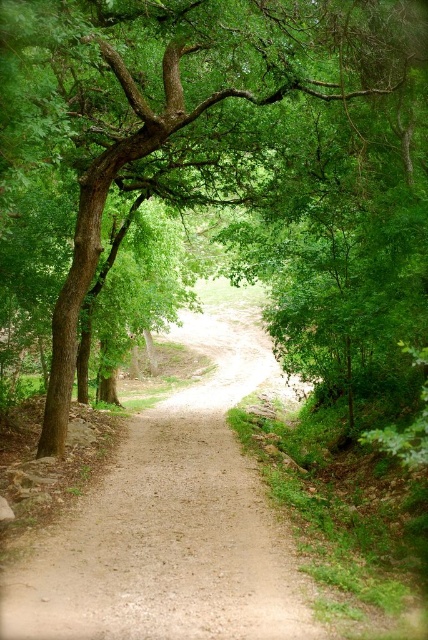
Question: Which point is farther from the camera taking this photo?

Choices:
 (A) (208, 442)
 (B) (345, 38)

Answer: (A)

Question: Which object appears closest to the camera in this image?

Choices:
 (A) green leafy tree at center
 (B) dirt path at center

Answer: (B)

Question: Which of the following is the farthest from the observer?

Choices:
 (A) dirt path at center
 (B) green leafy tree at center

Answer: (B)

Question: Is green leafy tree at center wider than dirt path at center?

Choices:
 (A) yes
 (B) no

Answer: (A)

Question: From the image, what is the correct spatial relationship of green leafy tree at center in relation to dirt path at center?

Choices:
 (A) above
 (B) below

Answer: (A)

Question: In this image, where is green leafy tree at center located relative to dirt path at center?

Choices:
 (A) below
 (B) above

Answer: (B)